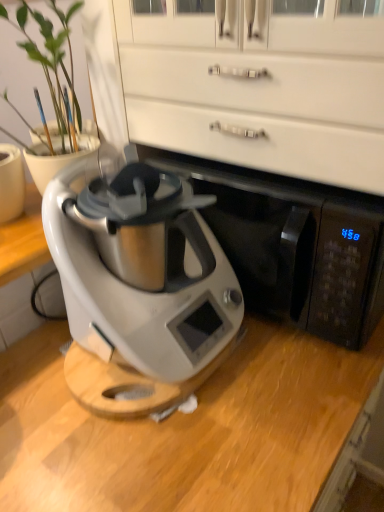
Question: Considering the relative sizes of satin silver appliance at center and satin silver appliance at center in the image provided, is satin silver appliance at center bigger than satin silver appliance at center?

Choices:
 (A) no
 (B) yes

Answer: (A)

Question: Does satin silver appliance at center appear on the left side of satin silver appliance at center?

Choices:
 (A) no
 (B) yes

Answer: (B)

Question: Does satin silver appliance at center have a lesser height compared to satin silver appliance at center?

Choices:
 (A) yes
 (B) no

Answer: (B)

Question: Is satin silver appliance at center aimed at satin silver appliance at center?

Choices:
 (A) no
 (B) yes

Answer: (A)

Question: Is satin silver appliance at center smaller than satin silver appliance at center?

Choices:
 (A) no
 (B) yes

Answer: (B)

Question: Is the depth of satin silver appliance at center greater than that of satin silver appliance at center?

Choices:
 (A) yes
 (B) no

Answer: (B)

Question: Considering the relative sizes of satin silver appliance at center and matte white vase at left in the image provided, is satin silver appliance at center smaller than matte white vase at left?

Choices:
 (A) no
 (B) yes

Answer: (A)

Question: Is satin silver appliance at center at the right side of matte white vase at left?

Choices:
 (A) yes
 (B) no

Answer: (A)

Question: Considering the relative sizes of satin silver appliance at center and matte white vase at left in the image provided, is satin silver appliance at center wider than matte white vase at left?

Choices:
 (A) yes
 (B) no

Answer: (A)

Question: Is satin silver appliance at center facing towards matte white vase at left?

Choices:
 (A) no
 (B) yes

Answer: (A)

Question: Is matte white vase at left surrounded by satin silver appliance at center?

Choices:
 (A) no
 (B) yes

Answer: (A)

Question: Can you see satin silver appliance at center touching matte white vase at left?

Choices:
 (A) yes
 (B) no

Answer: (B)

Question: Is white glossy dresser at upper center shorter than satin silver appliance at center?

Choices:
 (A) no
 (B) yes

Answer: (B)